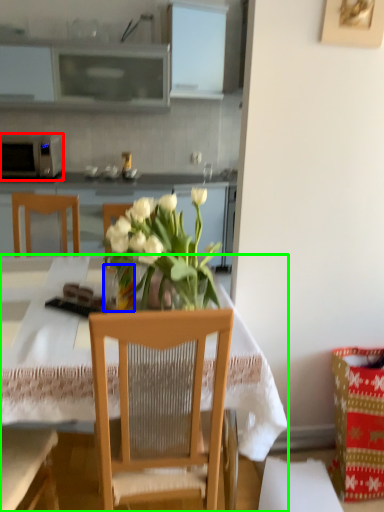
Question: Which object is the farthest from microwave oven (highlighted by a red box)? Choose among these: vase (highlighted by a blue box) or desk (highlighted by a green box).

Choices:
 (A) vase
 (B) desk

Answer: (A)